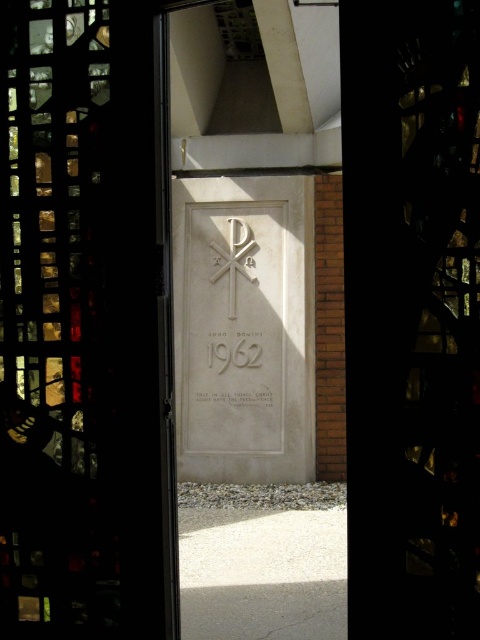
Describe the element at coordinates (82, 317) in the screenshot. I see `transparent glass door at center` at that location.

Identify the location of transparent glass door at center. The width and height of the screenshot is (480, 640). (82, 317).

Who is shorter, white stone cross at center or white stone writing at center?

With less height is white stone writing at center.

Who is lower down, white stone cross at center or white stone writing at center?

white stone writing at center is lower down.

Does point (232, 237) come closer to viewer compared to point (256, 349)?

No, it is not.

This screenshot has height=640, width=480. Find the location of `white stone cross at center`. white stone cross at center is located at coordinates point(235,259).

Who is positioned more to the left, transparent stained glass at center or white stone plaque at center?

white stone plaque at center

Between transparent stained glass at center and white stone plaque at center, which one has more height?

Standing taller between the two is white stone plaque at center.

The image size is (480, 640). What do you see at coordinates (411, 316) in the screenshot?
I see `transparent stained glass at center` at bounding box center [411, 316].

Find the location of a particular element. This screenshot has height=640, width=480. transparent stained glass at center is located at coordinates (411, 316).